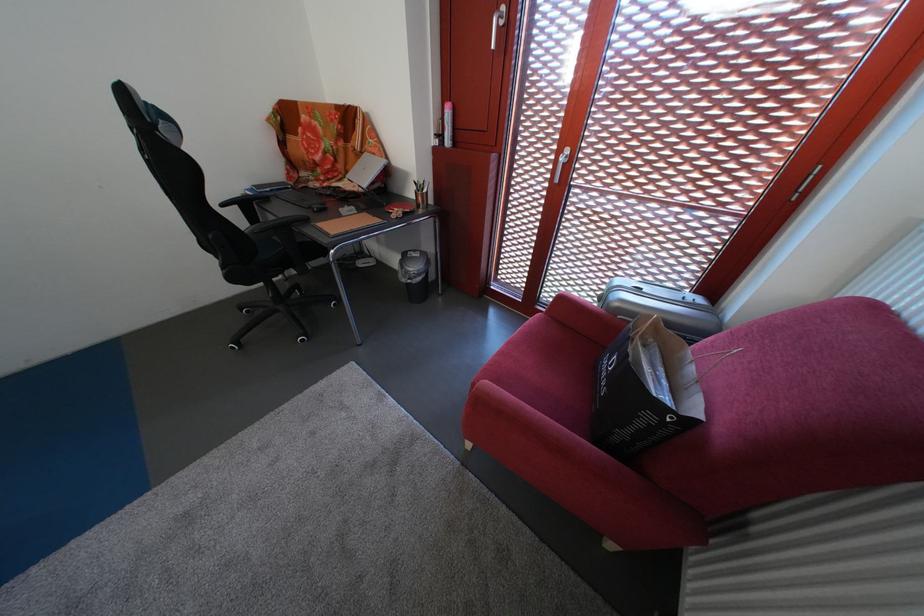
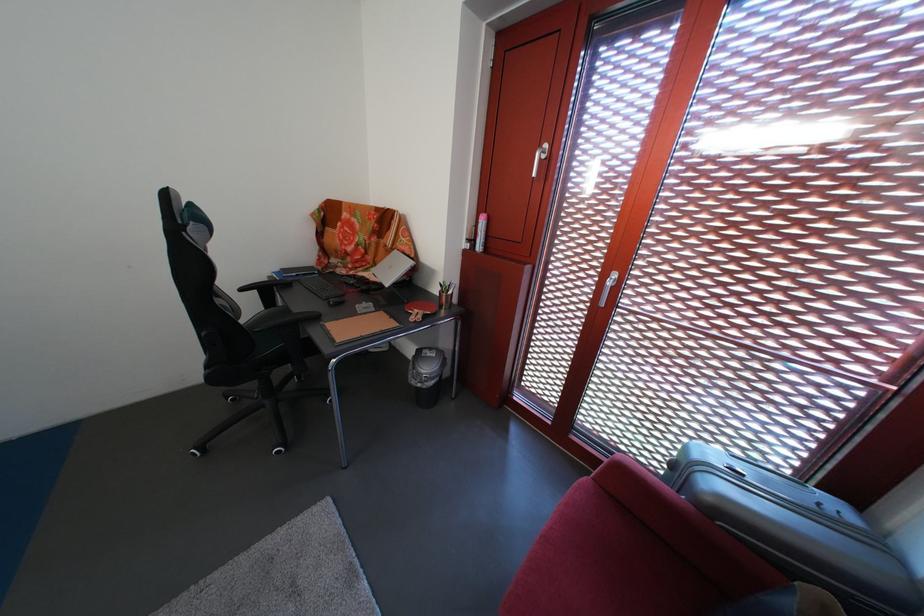
Locate, in the second image, the point that corresponds to point (612, 305) in the first image.

(684, 472)